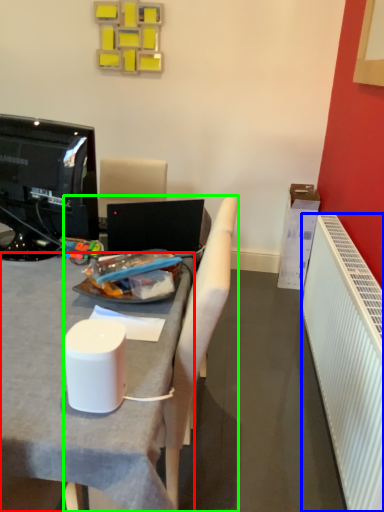
Question: Estimate the real-world distances between objects in this image. Which object is closer to desk (highlighted by a red box), radiator (highlighted by a blue box) or chair (highlighted by a green box)?

Choices:
 (A) radiator
 (B) chair

Answer: (B)